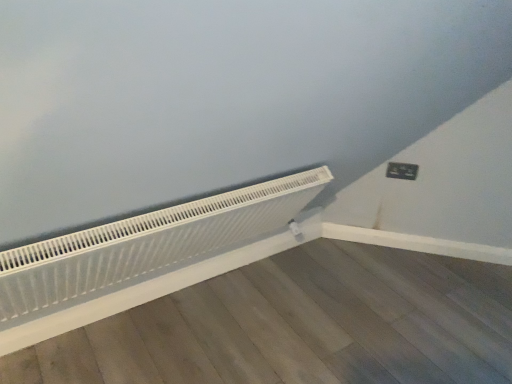
Where is `empty space that is to the right of white matte radiator at lower left`? This screenshot has height=384, width=512. empty space that is to the right of white matte radiator at lower left is located at coordinates (378, 306).